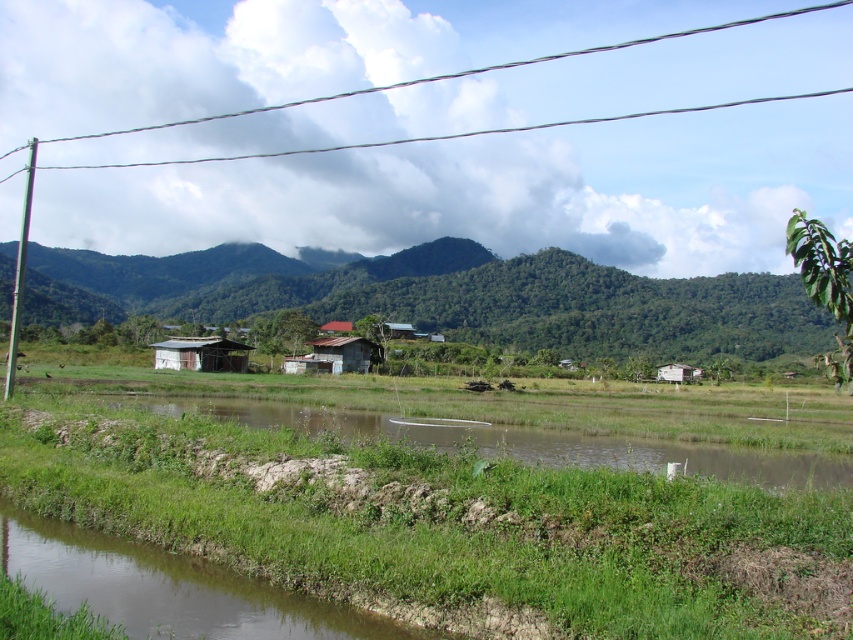
Based on the photo, you are a surveyor trying to map the coordinates of landmarks in this rural landscape. You notice the metallic wire at upper center. What are its coordinates?

The metallic wire at upper center is located at coordinates point (466,72).

You are standing at the edge of the brown corrugated metal hut at lower left and want to cross to the green grassy river at lower center. Which direction should you move to reach it?

You should move to the right to reach the green grassy river at lower center since it is located to the right of the brown corrugated metal hut at lower left.

You are a photographer planning to capture the rusty corrugated hut at center and the metallic wire at upper center in a single frame. Considering their heights, which object will appear larger in the photo?

The metallic wire at upper center is much taller than the rusty corrugated hut at center, so it will appear larger in the photo.